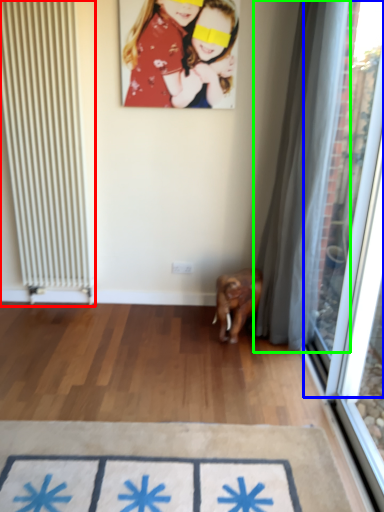
Question: Which object is positioned closest to radiator (highlighted by a red box)? Select from window screen (highlighted by a blue box) and curtain (highlighted by a green box).

Choices:
 (A) window screen
 (B) curtain

Answer: (B)